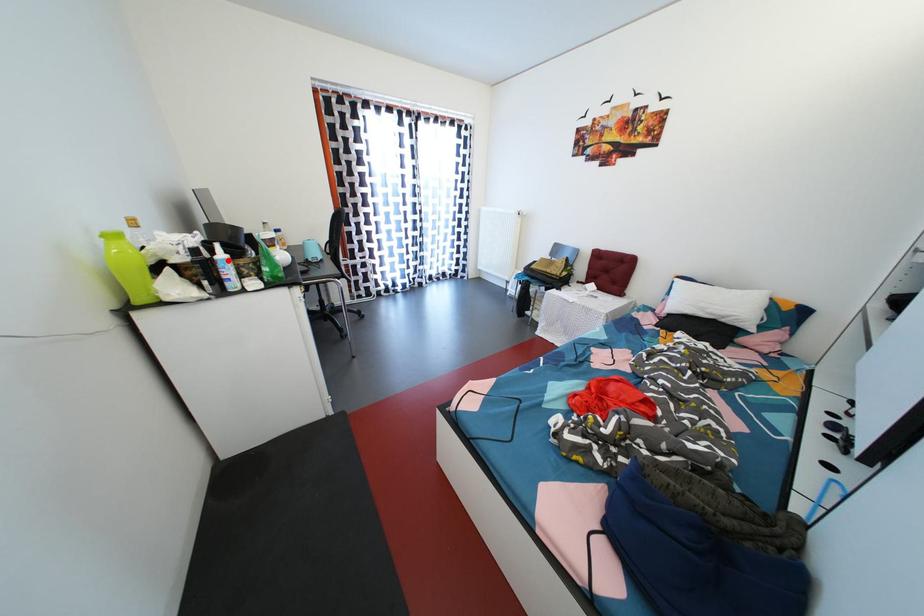
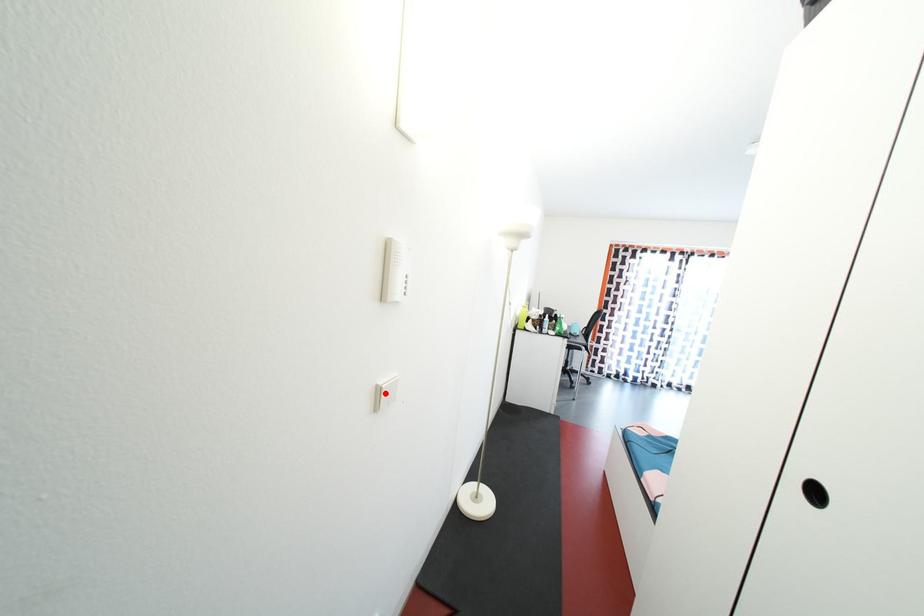
I am providing you with two images of the same scene from different viewpoints. A red point is marked on the first image and another point is marked on the second image. Is the red point in image1 aligned with the point shown in image2?

No